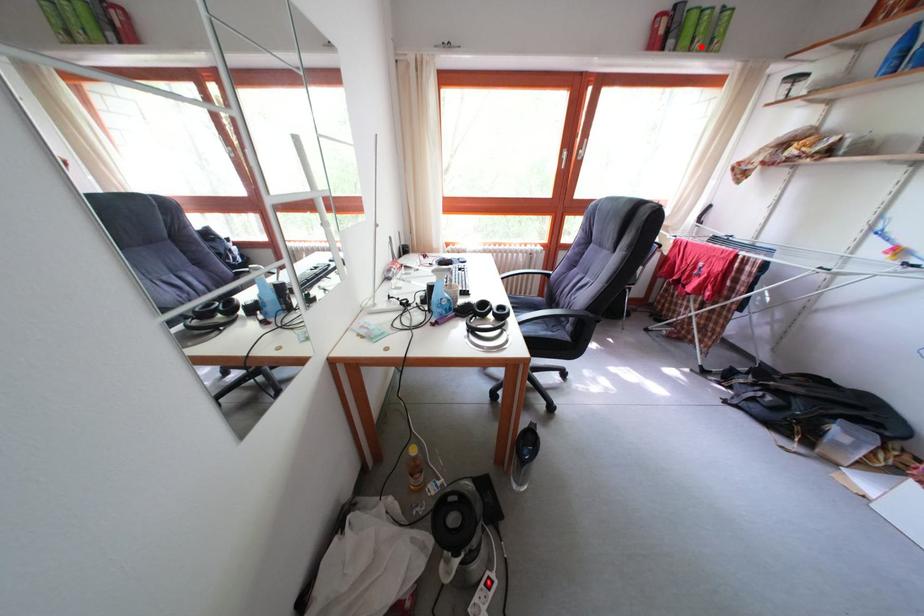
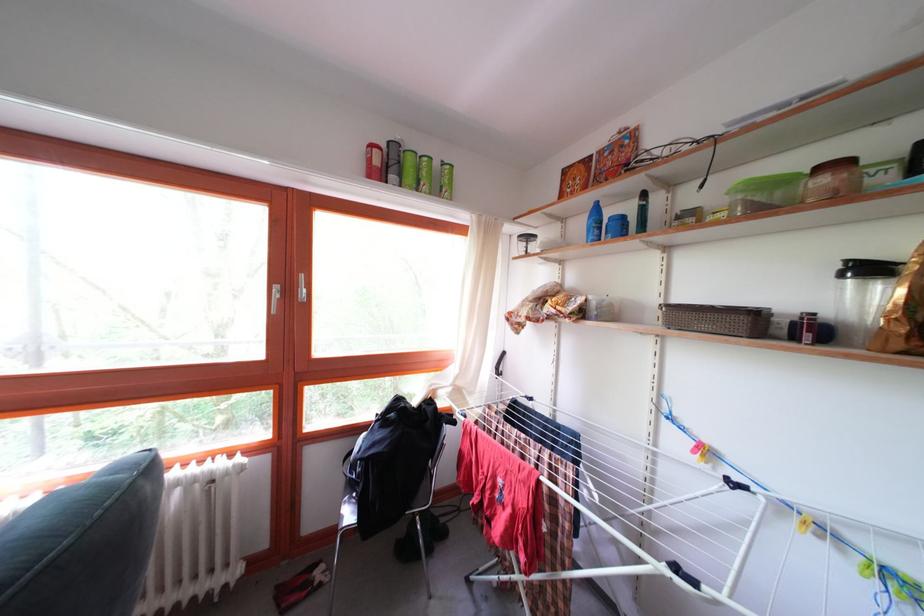
Find the pixel in the second image that matches the highlighted location in the first image.

(428, 187)